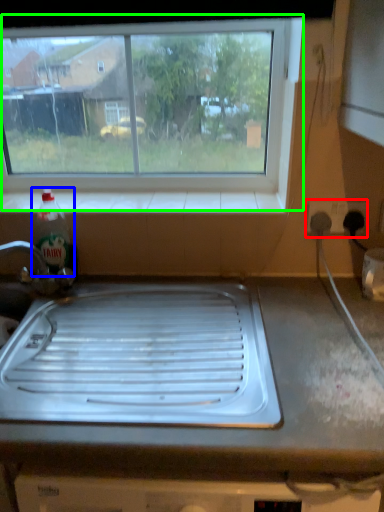
Question: Which object is the farthest from electric outlet (highlighted by a red box)? Choose among these: bottle (highlighted by a blue box) or window (highlighted by a green box).

Choices:
 (A) bottle
 (B) window

Answer: (A)